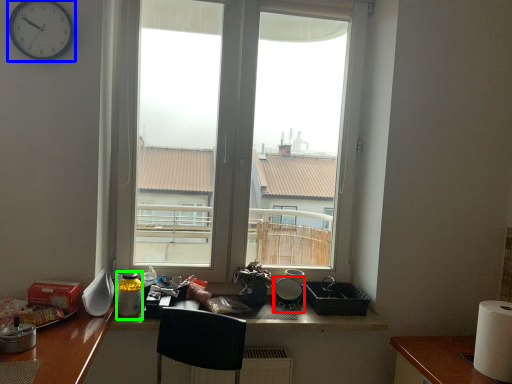
Question: Which is farther away from appliance (highlighted by a red box)? clock (highlighted by a blue box) or bottle (highlighted by a green box)?

Choices:
 (A) clock
 (B) bottle

Answer: (A)